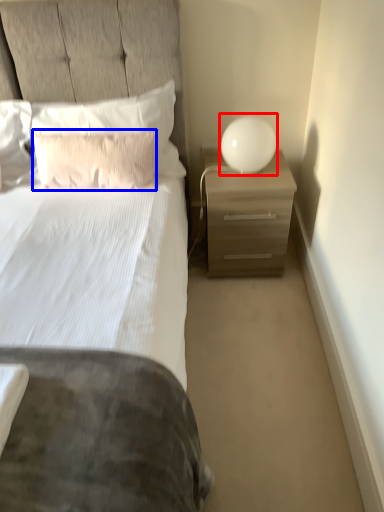
Question: Which point is further to the camera, table lamp (highlighted by a red box) or pillow (highlighted by a blue box)?

Choices:
 (A) table lamp
 (B) pillow

Answer: (A)